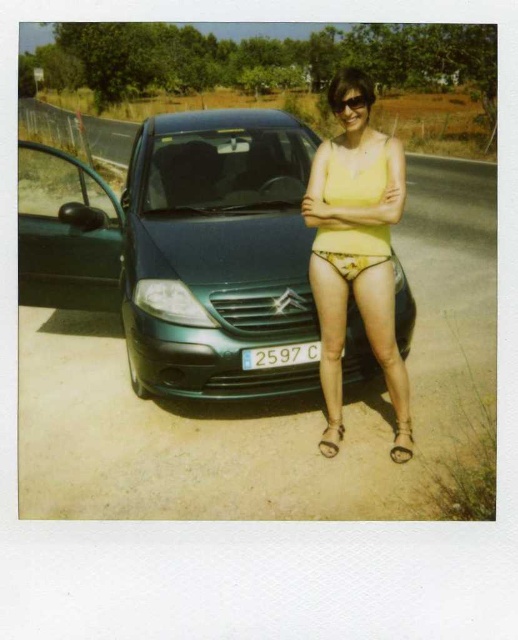
Consider the image. Between brown leather sandal at lower right and leather at front, which one has more height?

→ brown leather sandal at lower right

Based on the photo, does brown leather sandal at lower right have a lesser height compared to leather at front?

In fact, brown leather sandal at lower right may be taller than leather at front.

The width and height of the screenshot is (518, 640). What are the coordinates of `brown leather sandal at lower right` in the screenshot? It's located at (401, 442).

From the picture: Who is shorter, leather at front or shiny black sunglasses at upper center?

leather at front is shorter.

Can you confirm if leather at front is positioned to the left of shiny black sunglasses at upper center?

Yes, leather at front is to the left of shiny black sunglasses at upper center.

Image resolution: width=518 pixels, height=640 pixels. Describe the element at coordinates (330, 438) in the screenshot. I see `leather at front` at that location.

Where is `leather at front`? leather at front is located at coordinates (330, 438).

Which of these two, yellow matte tank top at center or yellow matte bikini top at center, stands taller?

yellow matte bikini top at center is taller.

This screenshot has height=640, width=518. What are the coordinates of `yellow matte tank top at center` in the screenshot? It's located at (355, 250).